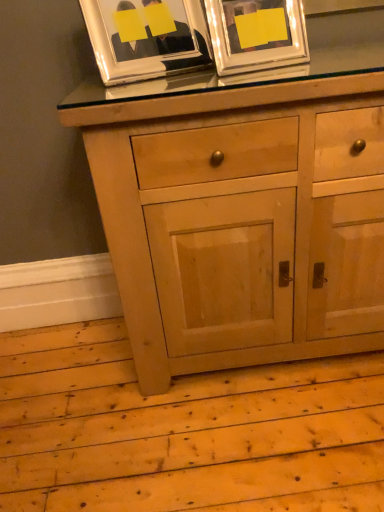
Where is `space that is in front of metallic silver picture frame at upper center, the second picture frame viewed from the left`? space that is in front of metallic silver picture frame at upper center, the second picture frame viewed from the left is located at coordinates (263, 84).